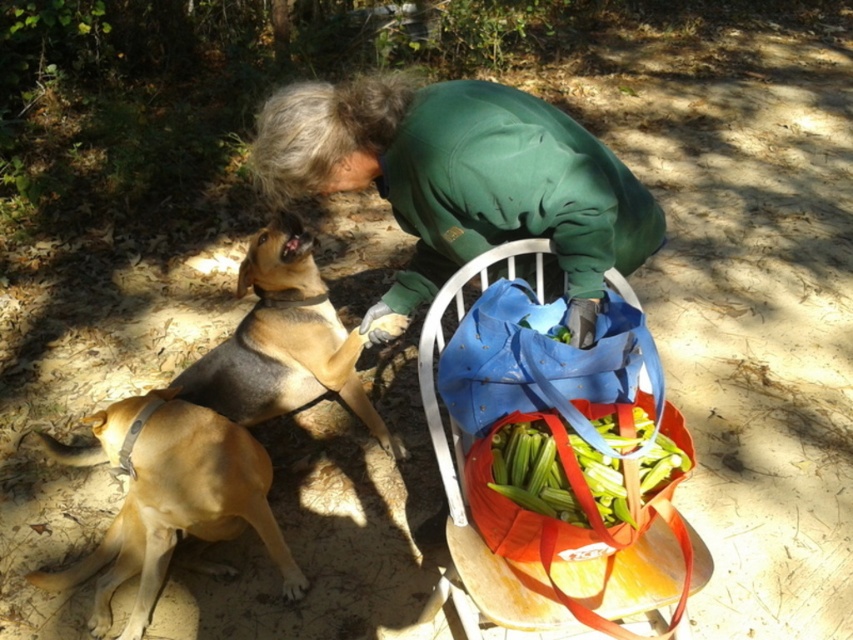
Is wooden chair at lower center shorter than golden fur dog at lower left?

Incorrect, wooden chair at lower center's height does not fall short of golden fur dog at lower left's.

Is wooden chair at lower center positioned in front of golden fur dog at lower left?

Yes, it is.

Who is more distant from viewer, (552, 602) or (167, 525)?

Point (167, 525)

Locate an element on the screen. Image resolution: width=853 pixels, height=640 pixels. wooden chair at lower center is located at coordinates (543, 522).

Is brown fur dog at lower left shorter than blue fabric bag at lower right?

Incorrect, brown fur dog at lower left's height does not fall short of blue fabric bag at lower right's.

Between brown fur dog at lower left and blue fabric bag at lower right, which one is positioned higher?

blue fabric bag at lower right

The width and height of the screenshot is (853, 640). What do you see at coordinates (283, 340) in the screenshot? I see `brown fur dog at lower left` at bounding box center [283, 340].

I want to click on brown fur dog at lower left, so click(283, 340).

Can you confirm if green fleece jacket at center is positioned to the left of green leafy vegetables at lower center?

Correct, you'll find green fleece jacket at center to the left of green leafy vegetables at lower center.

Does green fleece jacket at center appear over green leafy vegetables at lower center?

Yes.

Between point (532, 150) and point (512, 451), which one is positioned behind?

Point (532, 150)

The width and height of the screenshot is (853, 640). I want to click on green fleece jacket at center, so click(x=462, y=179).